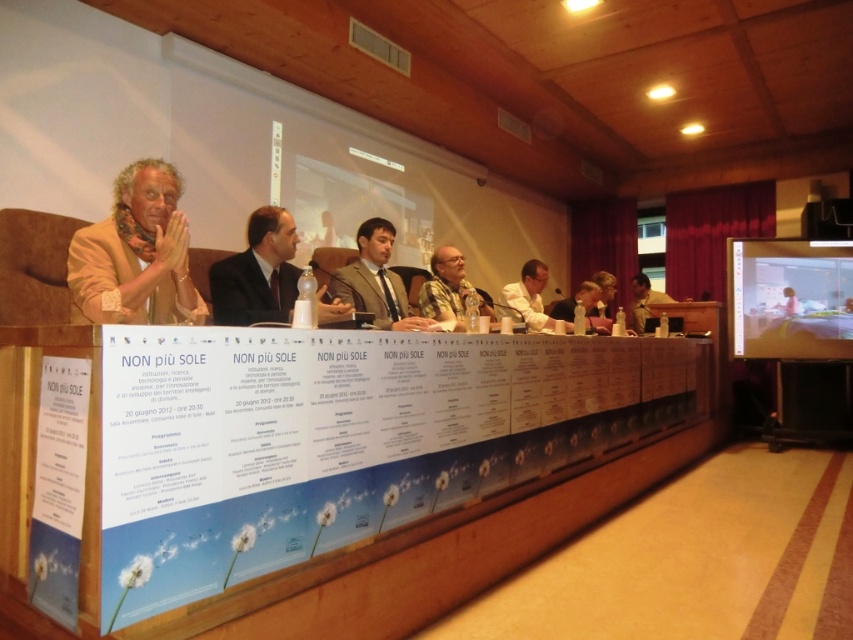
Is golden textured jacket at left above light brown wooden chair at right?

Indeed, golden textured jacket at left is positioned over light brown wooden chair at right.

Is point (140, 198) positioned behind point (634, 308)?

No, (140, 198) is in front of (634, 308).

Where is `golden textured jacket at left`? The height and width of the screenshot is (640, 853). golden textured jacket at left is located at coordinates (135, 253).

Who is lower down, dark suit jacket at center or dark gray suit at center?

dark gray suit at center is below.

Is dark suit jacket at center below dark gray suit at center?

No.

Does point (258, 243) lie behind point (361, 244)?

No, (258, 243) is closer to viewer.

At what (x,y) coordinates should I click in order to perform the action: click on dark suit jacket at center. Please return your answer as a coordinate pair (x, y). Looking at the image, I should click on (257, 273).

Based on the photo, who is higher up, dark suit jacket at center or light brown wooden chair at right?

dark suit jacket at center

Who is lower down, dark suit jacket at center or light brown wooden chair at right?

light brown wooden chair at right is lower down.

The width and height of the screenshot is (853, 640). In order to click on dark suit jacket at center in this screenshot , I will do `click(257, 273)`.